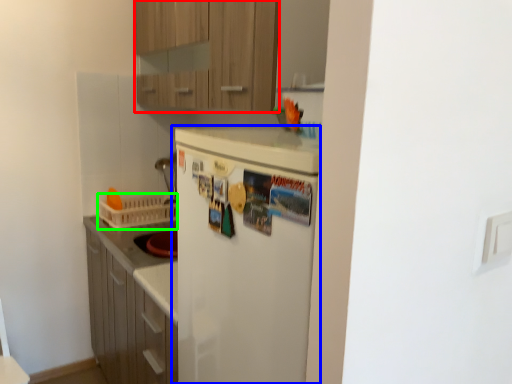
Question: Which object is positioned closest to cabinetry (highlighted by a red box)? Select from refrigerator (highlighted by a blue box) and basket (highlighted by a green box).

Choices:
 (A) refrigerator
 (B) basket

Answer: (A)